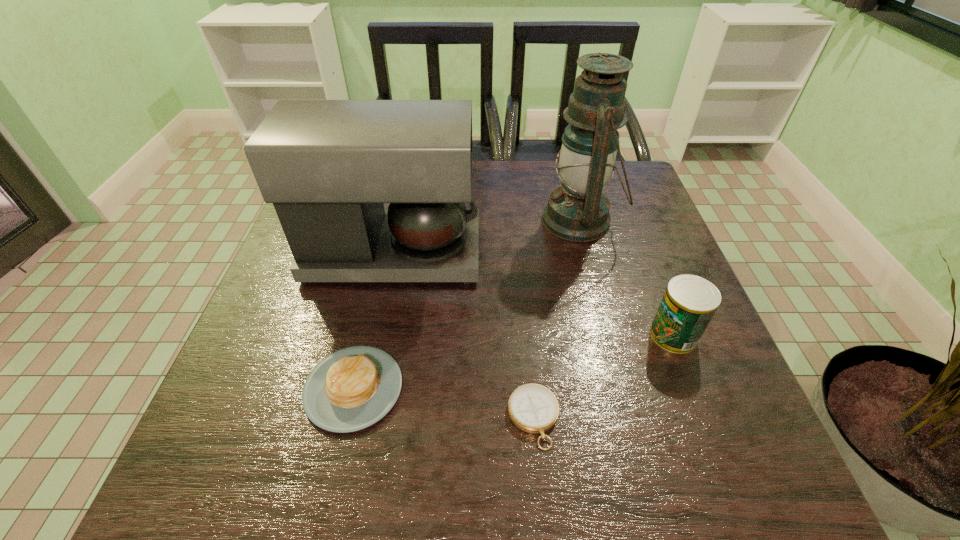
You are a GUI agent. You are given a task and a screenshot of the screen. Output one action in this format:
    pyautogui.click(x=<x>, y=<y>)
    Task: Click on the free space that satisfies the following two spatial constraints: 1. on the back side of the oil lamp; 2. on the right side of the shortest object
    The width and height of the screenshot is (960, 540).
    Given the screenshot: What is the action you would take?
    pyautogui.click(x=516, y=220)